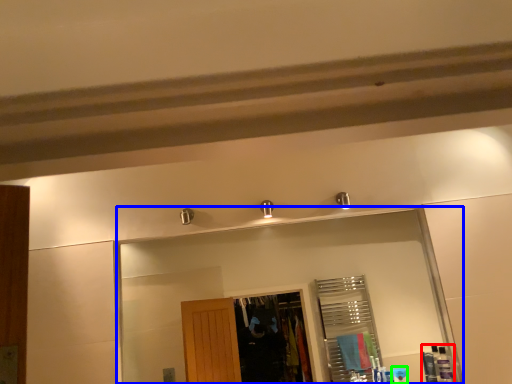
Question: Estimate the real-world distances between objects in this image. Which object is farther from toiletry (highlighted by a red box), mirror (highlighted by a blue box) or toiletry (highlighted by a green box)?

Choices:
 (A) mirror
 (B) toiletry

Answer: (A)